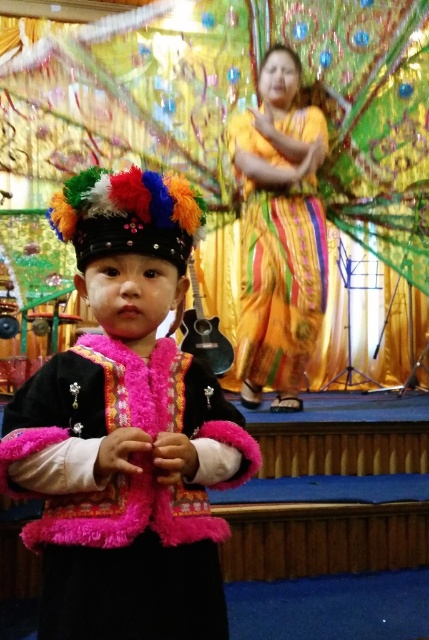
You are an event photographer at the festival. You need to capture a photo where both the fuzzy pink vest at center and the shiny yellow fabric dress at center are visible. Based on their positions, which object should be placed on the left side of the photo frame?

The fuzzy pink vest at center should be placed on the left side of the photo frame because it is located to the left of the shiny yellow fabric dress at center.

You are a photographer at the event and want to capture both the fuzzy pink vest at center and the shiny yellow fabric dress at center in a single photo. Which object should you focus on first to ensure both are in frame?

You should focus on the shiny yellow fabric dress at center first because it is taller than the fuzzy pink vest at center, ensuring both can be captured in the frame.

You are an event planner setting up a photo shoot at the festival. You need to position a camera so it can capture both the fuzzy pink vest at center and the shiny yellow fabric dress at center in the same frame. Based on their positions, which object should you place the camera closer to in order to include both in the shot?

The camera should be placed closer to the shiny yellow fabric dress at center because the fuzzy pink vest at center is located below it, meaning the dress is higher up and the vest is lower. Positioning the camera closer to the dress would allow both to be in the frame by angling downward to include the vest below.